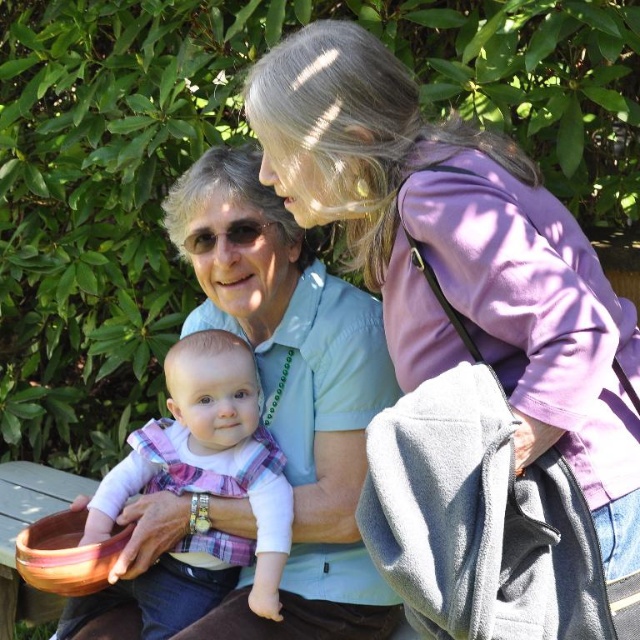
Question: Which object is farther from the camera taking this photo?

Choices:
 (A) matte blue shirt at center
 (B) purple matte jacket at upper right

Answer: (A)

Question: Is matte blue shirt at center wider than plaid fabric baby at center?

Choices:
 (A) yes
 (B) no

Answer: (A)

Question: Which point is closer to the camera?

Choices:
 (A) (241, 445)
 (B) (172, 216)

Answer: (A)

Question: Is purple matte jacket at upper right closer to camera compared to plaid fabric baby at center?

Choices:
 (A) yes
 (B) no

Answer: (A)

Question: Which object is the farthest from the plaid fabric baby at center?

Choices:
 (A) purple matte jacket at upper right
 (B) matte blue shirt at center

Answer: (A)

Question: Can you confirm if purple matte jacket at upper right is thinner than plaid fabric baby at center?

Choices:
 (A) yes
 (B) no

Answer: (B)